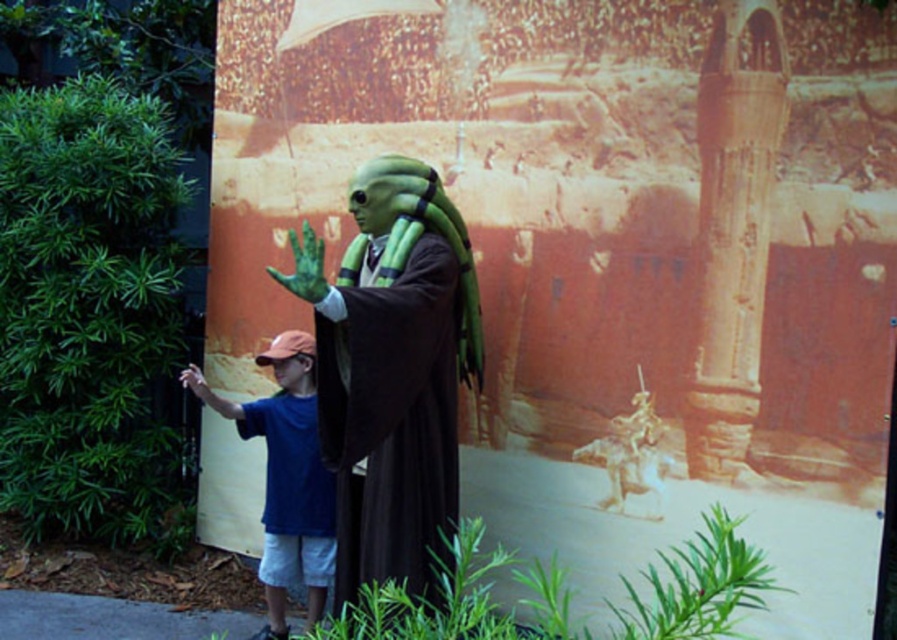
You are a visitor at the themed attraction and want to take a photo with both the green matte alien at center and the blue cotton shirt at left. Since you have a wide angle lens, can you fit both in the frame without zooming in?

The green matte alien at center is wider than the blue cotton shirt at left, so you can fit both in the frame as long as you position them side by side and ensure there is enough space between them to accommodate their widths.

You are a photographer trying to capture a photo of the blue cotton shirt at left and the green matte hand at center. Which object should you zoom in on to make them appear the same size in the photo?

Since the blue cotton shirt at left is larger than the green matte hand at center, you should zoom in on the green matte hand at center to make them appear the same size in the photo.